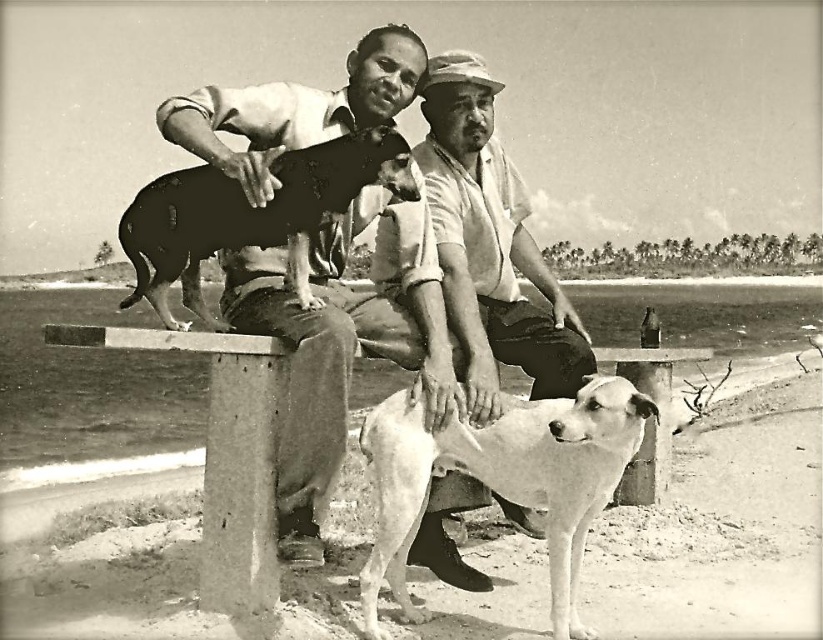
Can you confirm if smooth leather jacket at center is positioned to the right of smooth white shirt at center?

No, smooth leather jacket at center is not to the right of smooth white shirt at center.

Is smooth leather jacket at center thinner than smooth white shirt at center?

No.

Is point (273, 124) positioned after point (489, 296)?

No, (273, 124) is in front of (489, 296).

Where is `smooth leather jacket at center`? smooth leather jacket at center is located at coordinates (337, 352).

Between point (482, 116) and point (194, 289), which one is positioned behind?

The point (482, 116) is more distant.

Does point (487, 257) come in front of point (159, 189)?

No, it is not.

Where is `smooth white shirt at center`? smooth white shirt at center is located at coordinates (491, 244).

The image size is (823, 640). I want to click on smooth white shirt at center, so click(x=491, y=244).

Is white smooth dog at center to the right of concrete bench at center from the viewer's perspective?

Correct, you'll find white smooth dog at center to the right of concrete bench at center.

Consider the image. Is white smooth dog at center positioned behind concrete bench at center?

Yes, white smooth dog at center is further from the viewer.

The height and width of the screenshot is (640, 823). In order to click on white smooth dog at center in this screenshot , I will do click(503, 480).

Where is `white smooth dog at center`? The width and height of the screenshot is (823, 640). white smooth dog at center is located at coordinates pos(503,480).